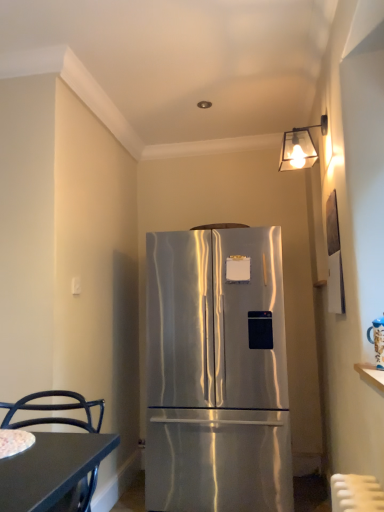
Question: From a real-world perspective, is metallic glass lampshade at upper right positioned over stainless steel refrigerator at center based on gravity?

Choices:
 (A) no
 (B) yes

Answer: (B)

Question: Considering the relative sizes of metallic glass lampshade at upper right and stainless steel refrigerator at center in the image provided, is metallic glass lampshade at upper right bigger than stainless steel refrigerator at center?

Choices:
 (A) yes
 (B) no

Answer: (B)

Question: From the image's perspective, is metallic glass lampshade at upper right over stainless steel refrigerator at center?

Choices:
 (A) yes
 (B) no

Answer: (A)

Question: Is metallic glass lampshade at upper right at the right side of stainless steel refrigerator at center?

Choices:
 (A) no
 (B) yes

Answer: (B)

Question: From a real-world perspective, does metallic glass lampshade at upper right sit lower than stainless steel refrigerator at center?

Choices:
 (A) no
 (B) yes

Answer: (A)

Question: Are metallic glass lampshade at upper right and stainless steel refrigerator at center making contact?

Choices:
 (A) no
 (B) yes

Answer: (A)

Question: From the image's perspective, is stainless steel refrigerator at center above metallic glass lampshade at upper right?

Choices:
 (A) yes
 (B) no

Answer: (B)

Question: Considering the relative sizes of stainless steel refrigerator at center and metallic glass lampshade at upper right in the image provided, is stainless steel refrigerator at center thinner than metallic glass lampshade at upper right?

Choices:
 (A) no
 (B) yes

Answer: (A)

Question: Is stainless steel refrigerator at center not close to metallic glass lampshade at upper right?

Choices:
 (A) yes
 (B) no

Answer: (A)

Question: Considering the relative sizes of stainless steel refrigerator at center and metallic glass lampshade at upper right in the image provided, is stainless steel refrigerator at center shorter than metallic glass lampshade at upper right?

Choices:
 (A) no
 (B) yes

Answer: (A)

Question: Considering the relative sizes of stainless steel refrigerator at center and metallic glass lampshade at upper right in the image provided, is stainless steel refrigerator at center bigger than metallic glass lampshade at upper right?

Choices:
 (A) yes
 (B) no

Answer: (A)

Question: Is stainless steel refrigerator at center oriented away from metallic glass lampshade at upper right?

Choices:
 (A) yes
 (B) no

Answer: (B)

Question: Considering the relative sizes of black metal chair at lower left and metallic glass lampshade at upper right in the image provided, is black metal chair at lower left thinner than metallic glass lampshade at upper right?

Choices:
 (A) no
 (B) yes

Answer: (A)